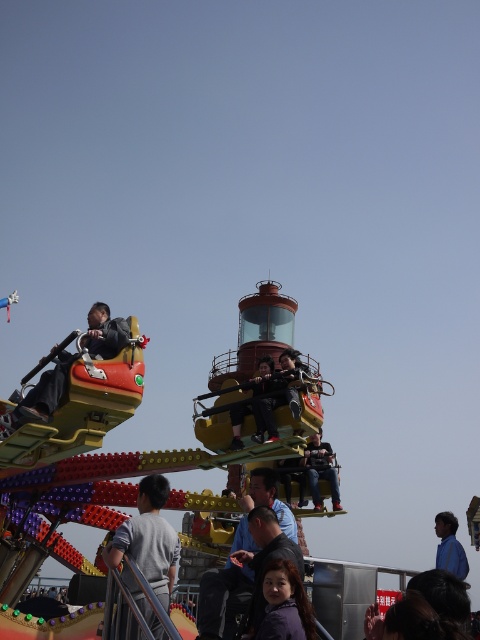
Is denim jeans at center above matte black helmet at center?

Incorrect, denim jeans at center is not positioned above matte black helmet at center.

Does point (326, 454) lie in front of point (296, 412)?

That is False.

Is point (312, 492) less distant than point (303, 365)?

No, (312, 492) is further to viewer.

The image size is (480, 640). In order to click on denim jeans at center in this screenshot , I will do `click(321, 468)`.

Does purple matte jacket at lower center lie behind matte black pants at center?

No, it is in front of matte black pants at center.

Is point (288, 611) in front of point (235, 433)?

Yes.

Who is more distant from viewer, (278, 579) or (242, 404)?

The point (242, 404) is behind.

At what (x,y) coordinates should I click in order to perform the action: click on purple matte jacket at lower center. Please return your answer as a coordinate pair (x, y). The width and height of the screenshot is (480, 640). Looking at the image, I should click on (285, 604).

Who is shorter, denim jeans at center or matte black pants at center?

denim jeans at center

Is denim jeans at center wider than matte black pants at center?

In fact, denim jeans at center might be narrower than matte black pants at center.

Measure the distance between point (320,476) and camera.

Point (320,476) and camera are 105.86 meters apart from each other.

This screenshot has height=640, width=480. What are the coordinates of `denim jeans at center` in the screenshot? It's located at (321, 468).